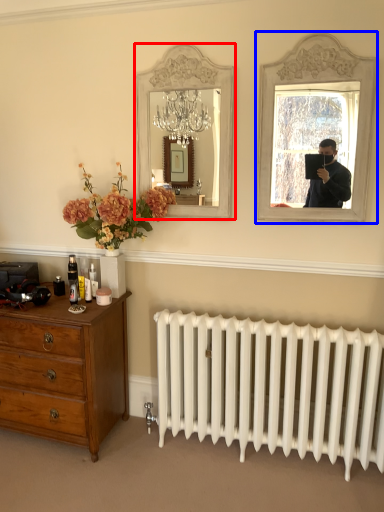
Question: Which object appears closest to the camera in this image, mirror (highlighted by a red box) or picture frame (highlighted by a blue box)?

Choices:
 (A) mirror
 (B) picture frame

Answer: (B)